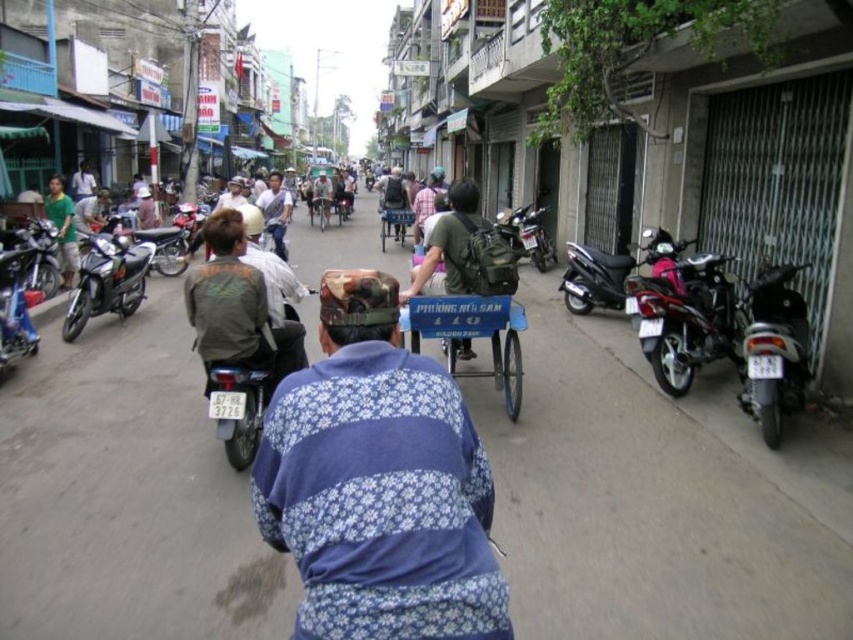
How distant is silver metallic motorcycle at left from shiny silver motorcycle at left?

They are 2.15 meters apart.

Consider the image. Can you confirm if silver metallic motorcycle at left is positioned above shiny silver motorcycle at left?

Incorrect, silver metallic motorcycle at left is not positioned above shiny silver motorcycle at left.

Is point (131, 243) in front of point (172, 232)?

That is True.

What are the coordinates of `silver metallic motorcycle at left` in the screenshot? It's located at (107, 280).

Can you confirm if metallic blue cart at center is bigger than silver metallic motorcycle at left?

Yes.

Can you confirm if metallic blue cart at center is smaller than silver metallic motorcycle at left?

Actually, metallic blue cart at center might be larger than silver metallic motorcycle at left.

I want to click on metallic blue cart at center, so click(x=656, y=500).

Locate an element on the screen. The image size is (853, 640). metallic blue cart at center is located at coordinates (656, 500).

Consider the image. Can you confirm if matte black motorcycle at center-left is bigger than silver metallic motorcycle at left?

Actually, matte black motorcycle at center-left might be smaller than silver metallic motorcycle at left.

Between point (244, 436) and point (93, 312), which one is positioned behind?

The point (93, 312) is more distant.

Where is `matte black motorcycle at center-left`? The width and height of the screenshot is (853, 640). matte black motorcycle at center-left is located at coordinates (238, 404).